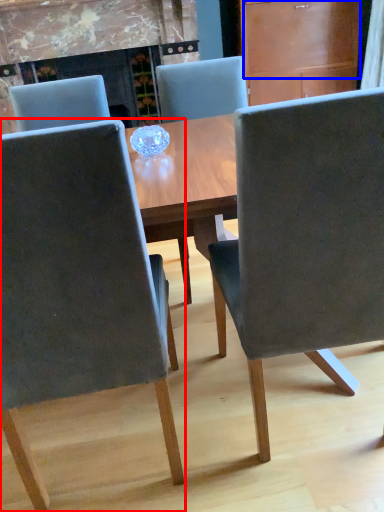
Question: Which object appears farthest to the camera in this image, chair (highlighted by a red box) or drawer (highlighted by a blue box)?

Choices:
 (A) chair
 (B) drawer

Answer: (B)